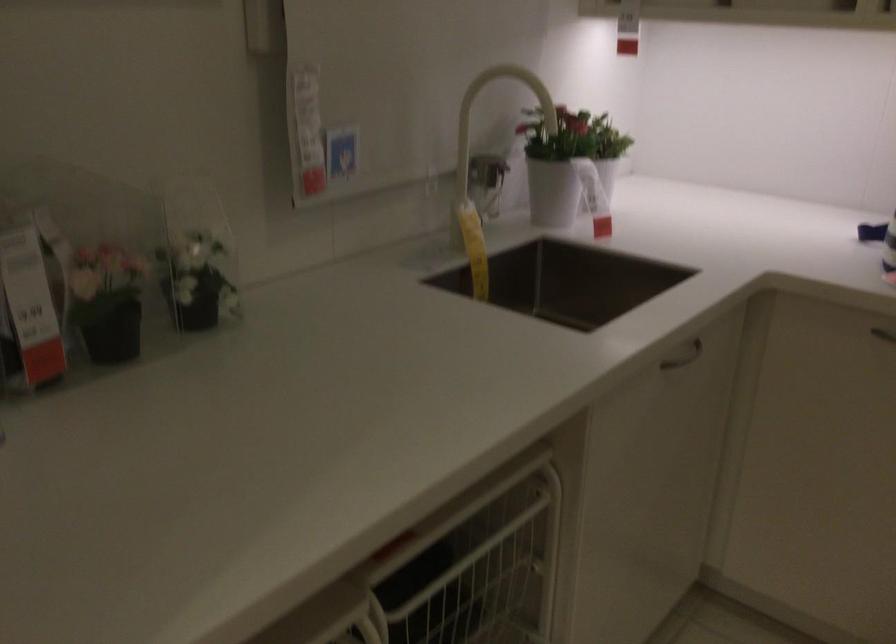
What do you see at coordinates (487, 184) in the screenshot? I see `the faucet handle` at bounding box center [487, 184].